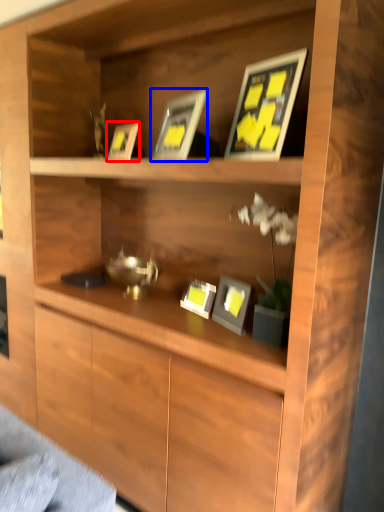
Question: Which object is further to the camera taking this photo, picture frame (highlighted by a red box) or picture frame (highlighted by a blue box)?

Choices:
 (A) picture frame
 (B) picture frame

Answer: (A)